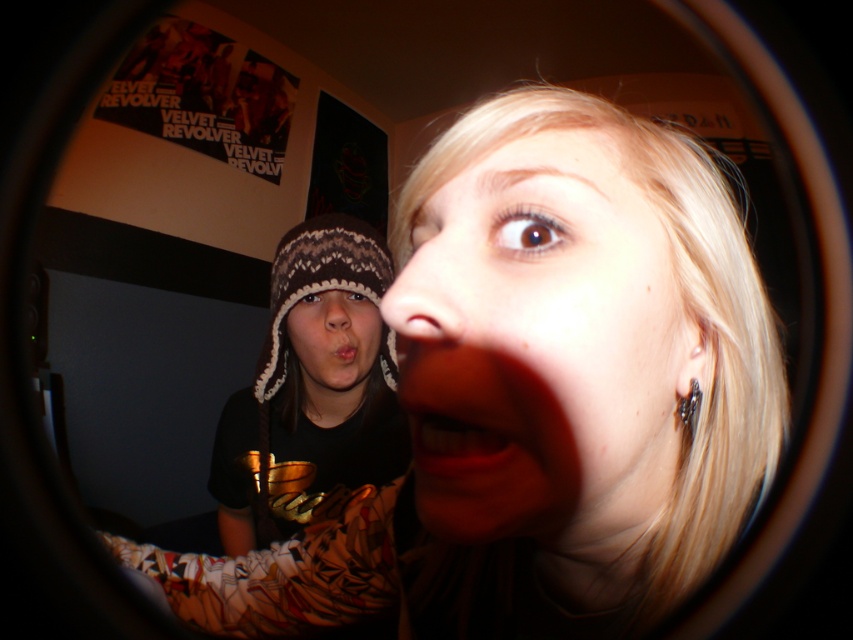
Looking at this image, looking at the image, which object is positioned to the right of the other between the matte skin nose at center and the pink matte lips at center?

The matte skin nose at center is to the right of the pink matte lips at center.

You are trying to determine which object in the image is larger. You see the matte black hat at upper left and the matte skin nose at center. Based on their sizes, which one would you say is larger?

The matte black hat at upper left is bigger than the matte skin nose at center, so the matte black hat at upper left is larger.